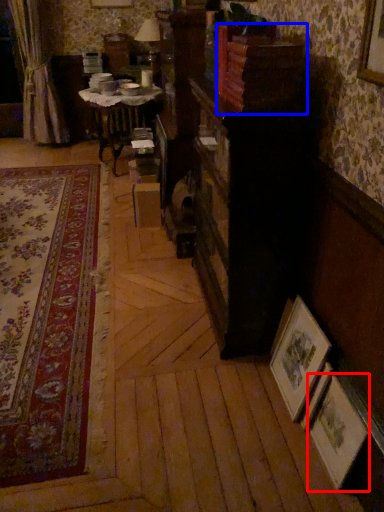
Question: Which object appears farthest to the camera in this image, picture frame (highlighted by a red box) or shelf (highlighted by a blue box)?

Choices:
 (A) picture frame
 (B) shelf

Answer: (B)